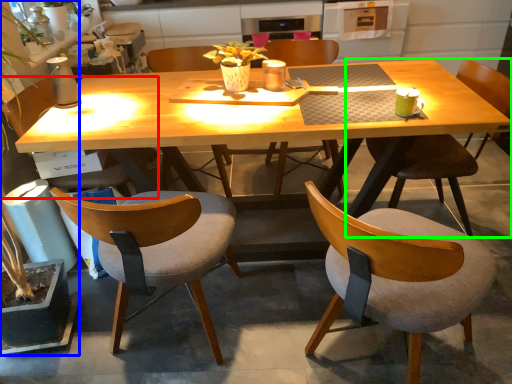
Question: Based on their relative distances, which object is nearer to chair (highlighted by a red box)? Choose from houseplant (highlighted by a blue box) and chair (highlighted by a green box).

Choices:
 (A) houseplant
 (B) chair

Answer: (A)